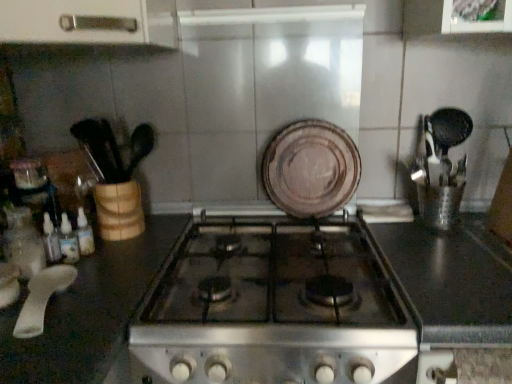
Where is `free space in front of brown matte plate at center`? free space in front of brown matte plate at center is located at coordinates (331, 230).